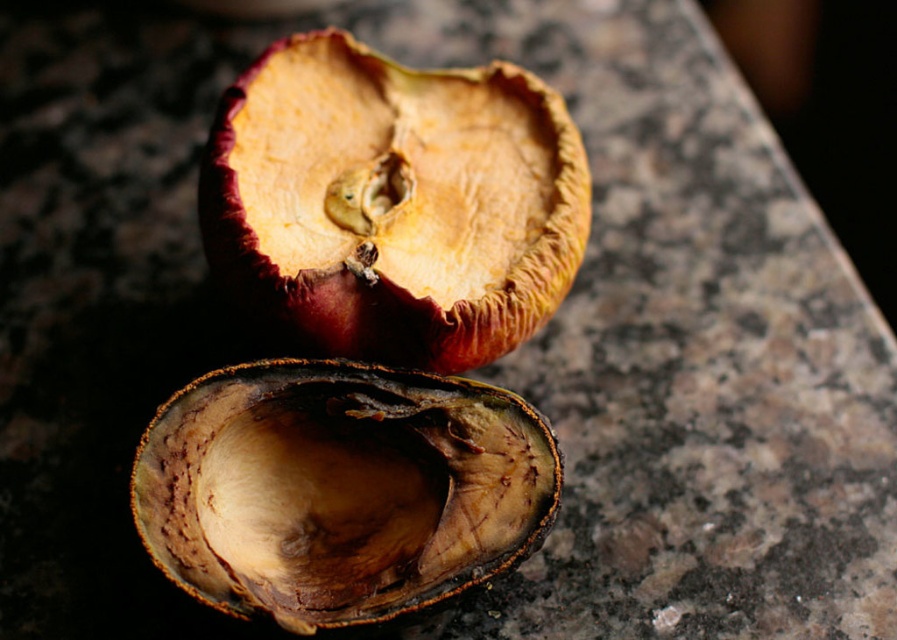
Question: Does brown leathery apple at upper center have a larger size compared to brown leathery shell at center?

Choices:
 (A) yes
 (B) no

Answer: (A)

Question: Is brown leathery apple at upper center below brown leathery shell at center?

Choices:
 (A) yes
 (B) no

Answer: (B)

Question: From the image, what is the correct spatial relationship of brown leathery apple at upper center in relation to brown leathery shell at center?

Choices:
 (A) above
 (B) below

Answer: (A)

Question: Which point is closer to the camera?

Choices:
 (A) brown leathery shell at center
 (B) brown leathery apple at upper center

Answer: (A)